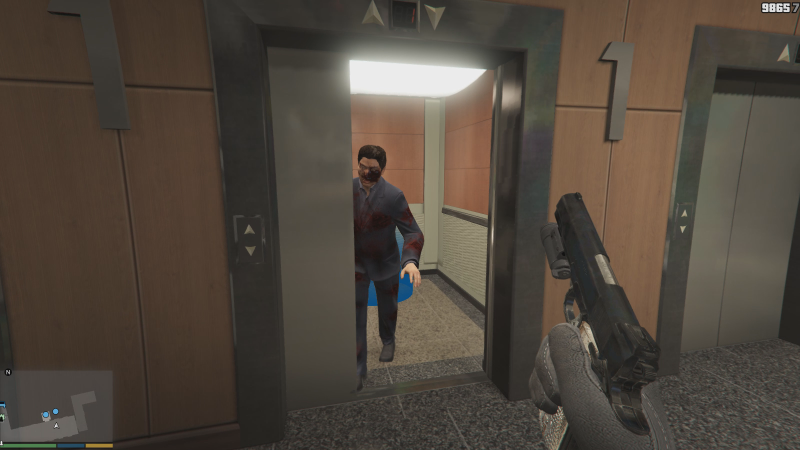
This screenshot has width=800, height=450. What are the coordinates of `elevator` in the screenshot? It's located at (434, 189).